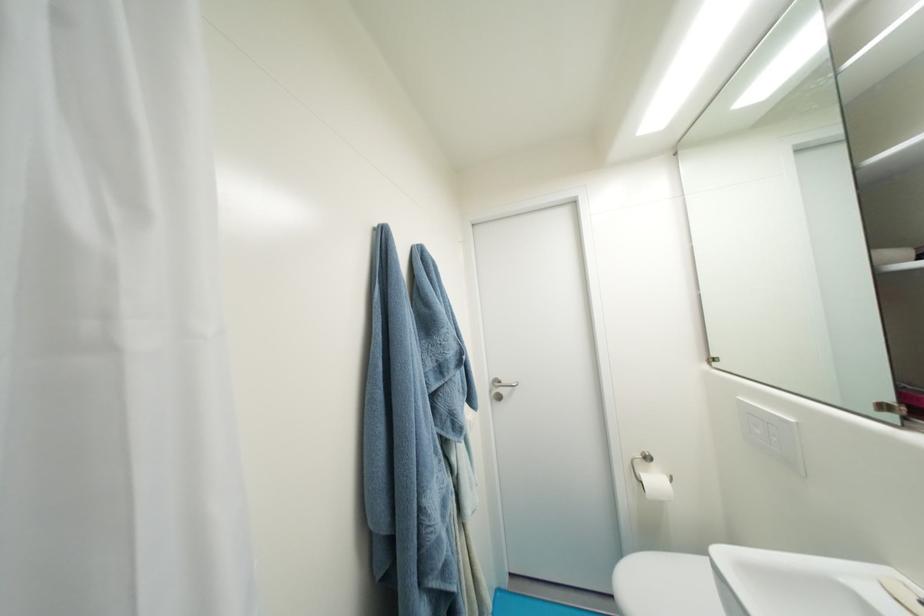
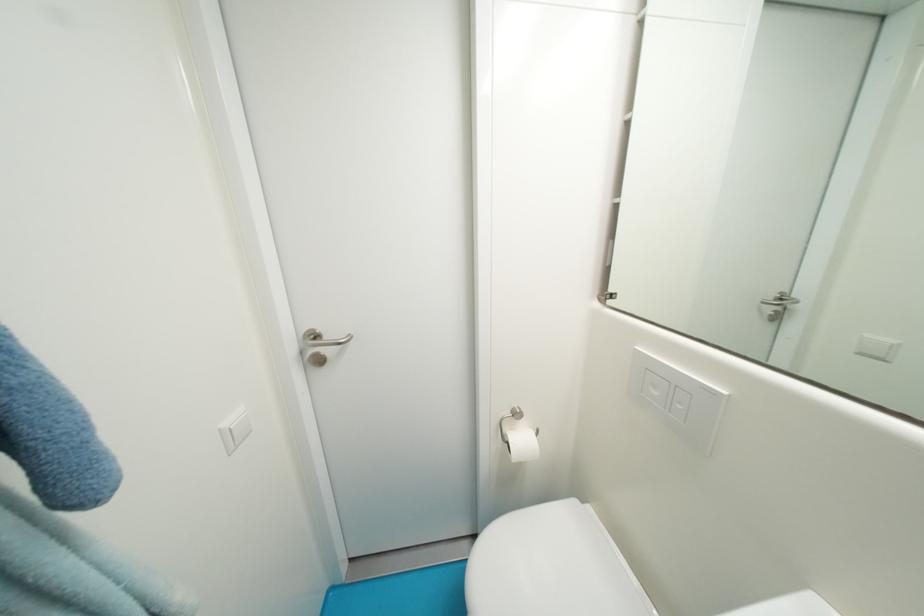
Find the pixel in the second image that matches point 505,384 in the first image.

(323, 339)